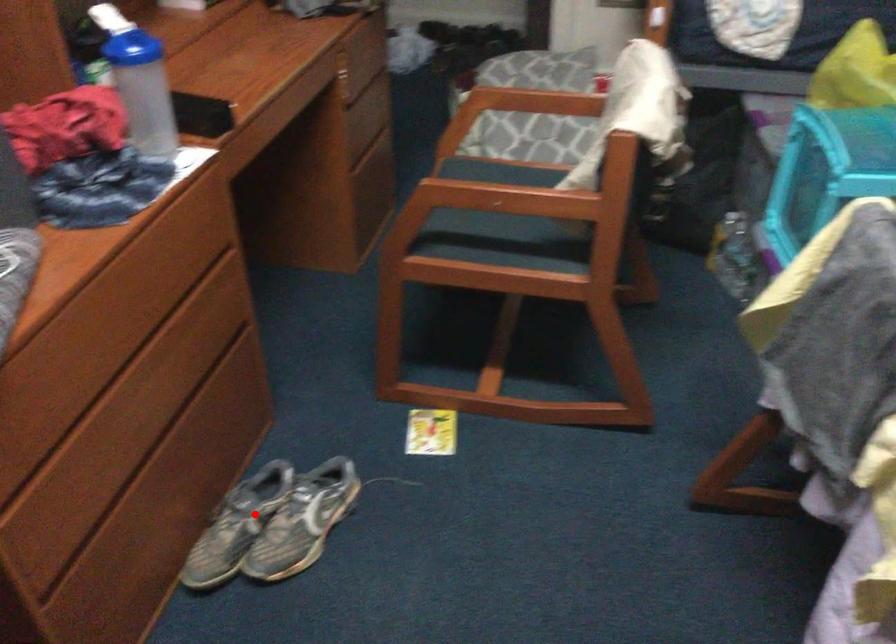
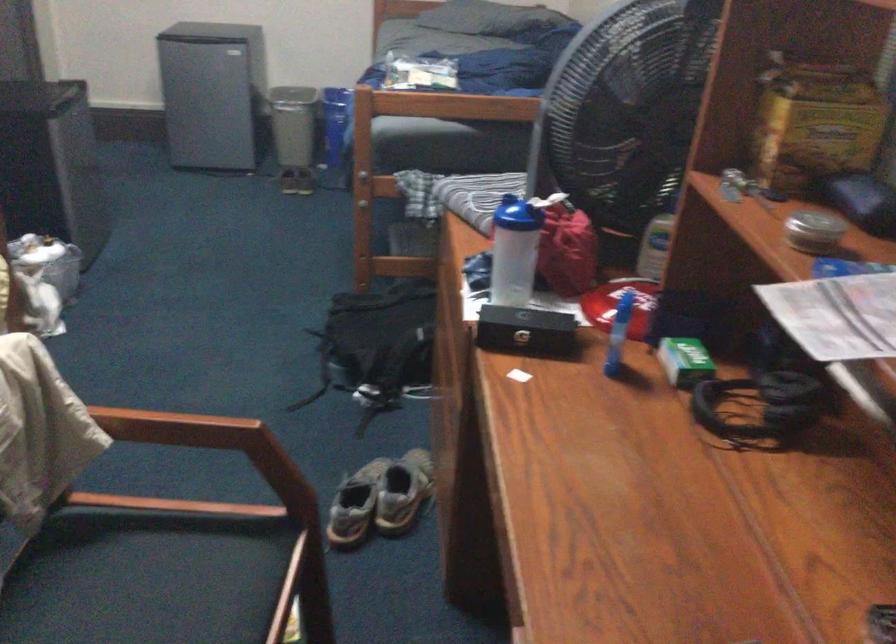
Question: I am providing you with two images of the same scene from different viewpoints. Given a red point in image1, look at the same physical point in image2. Is it:

Choices:
 (A) Closer to the viewpoint
 (B) Farther from the viewpoint

Answer: (B)